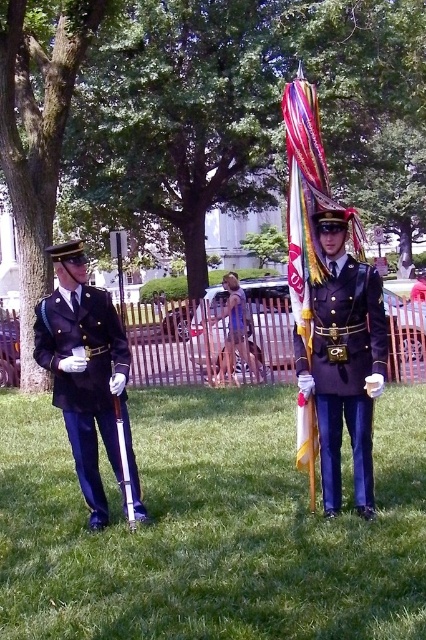
You are a photographer trying to capture a clear photo of both the navy blue fabric uniform at left and the shiny metallic flag at center. Which object should you focus on first if you want to ensure both are in focus without adjusting the camera settings?

You should focus on the navy blue fabric uniform at left first because it is closer to the camera than the shiny metallic flag at center. By focusing on the closer object, the farther object will still be within the depth of field.